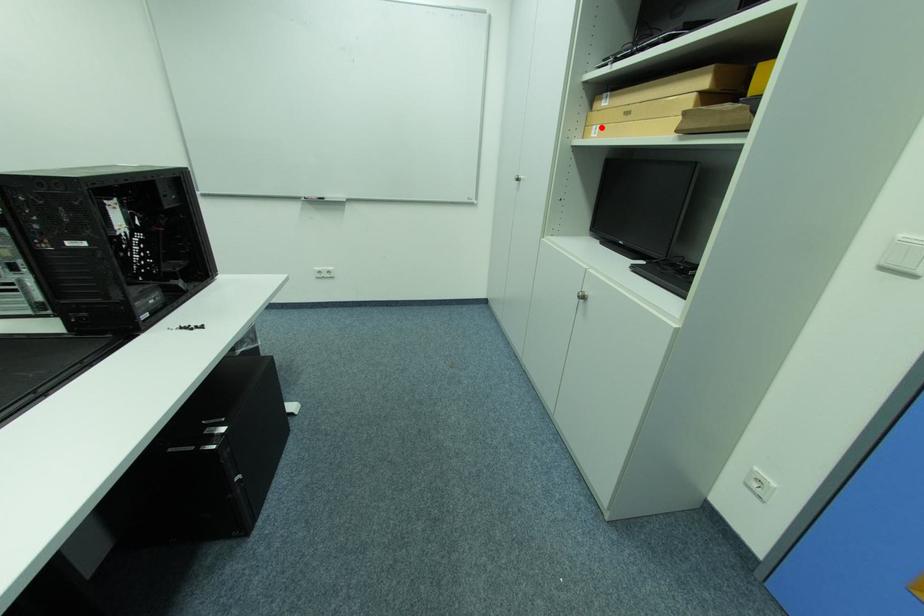
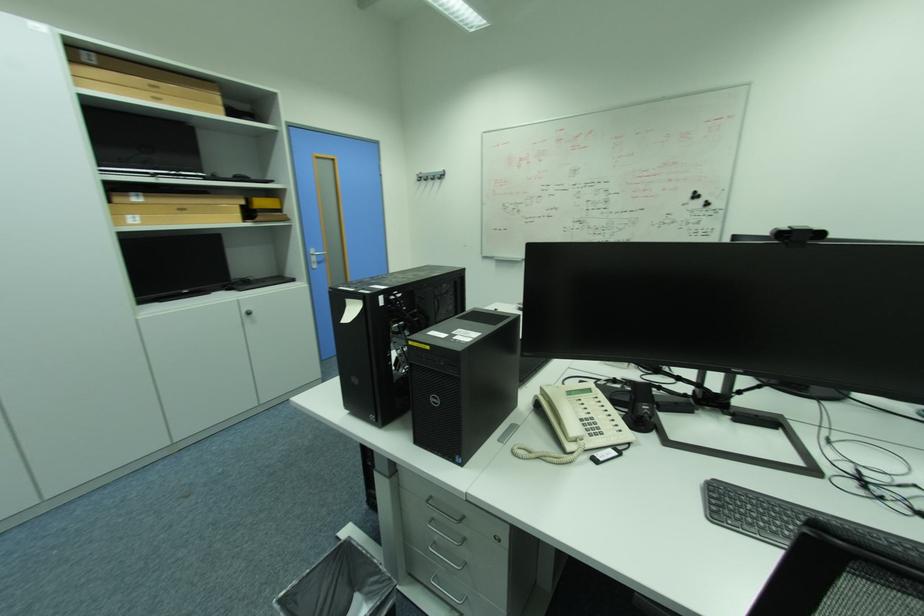
Where in the second image is the point corresponding to the highlighted location from the first image?

(136, 217)